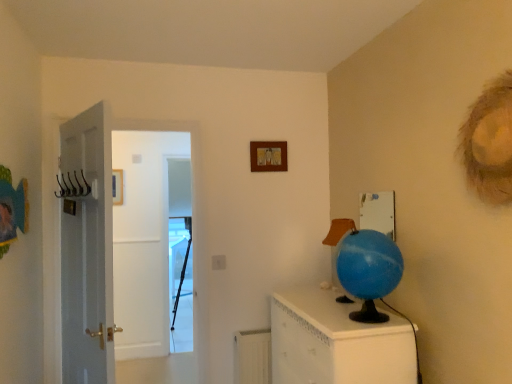
Question: Does white plastic radiator at lower center appear on the right side of wooden picture frame at upper center?

Choices:
 (A) no
 (B) yes

Answer: (A)

Question: Is white plastic radiator at lower center outside wooden picture frame at upper center?

Choices:
 (A) yes
 (B) no

Answer: (A)

Question: From a real-world perspective, does white plastic radiator at lower center stand above wooden picture frame at upper center?

Choices:
 (A) yes
 (B) no

Answer: (B)

Question: From a real-world perspective, is white plastic radiator at lower center beneath wooden picture frame at upper center?

Choices:
 (A) yes
 (B) no

Answer: (A)

Question: Considering the relative sizes of white plastic radiator at lower center and wooden picture frame at upper center in the image provided, is white plastic radiator at lower center bigger than wooden picture frame at upper center?

Choices:
 (A) no
 (B) yes

Answer: (B)

Question: Looking at their shapes, would you say transparent plastic screen door at center is wider or thinner than wooden picture frame at upper center?

Choices:
 (A) wide
 (B) thin

Answer: (A)

Question: From the image's perspective, is transparent plastic screen door at center located above or below wooden picture frame at upper center?

Choices:
 (A) below
 (B) above

Answer: (A)

Question: Do you think transparent plastic screen door at center is within wooden picture frame at upper center, or outside of it?

Choices:
 (A) outside
 (B) inside

Answer: (A)

Question: Does point (186, 160) appear closer or farther from the camera than point (276, 150)?

Choices:
 (A) closer
 (B) farther

Answer: (B)

Question: Is blue glossy globe at right situated inside metallic wire hanger at left or outside?

Choices:
 (A) inside
 (B) outside

Answer: (B)

Question: Would you say blue glossy globe at right is to the left or to the right of metallic wire hanger at left in the picture?

Choices:
 (A) right
 (B) left

Answer: (A)

Question: Does point (302, 296) appear closer or farther from the camera than point (61, 188)?

Choices:
 (A) closer
 (B) farther

Answer: (A)

Question: From a real-world perspective, relative to metallic wire hanger at left, is blue glossy globe at right vertically above or below?

Choices:
 (A) above
 (B) below

Answer: (B)

Question: Is point (184, 243) closer or farther from the camera than point (352, 220)?

Choices:
 (A) closer
 (B) farther

Answer: (B)

Question: Is transparent plastic screen door at center in front of or behind blue rubber globe at right in the image?

Choices:
 (A) behind
 (B) front

Answer: (A)